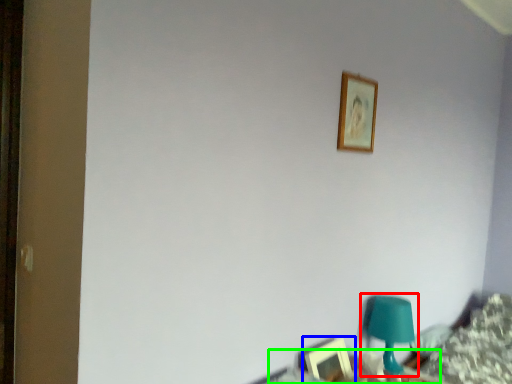
Question: Estimate the real-world distances between objects in this image. Which object is farther from table lamp (highlighted by a red box), picture frame (highlighted by a blue box) or table (highlighted by a green box)?

Choices:
 (A) picture frame
 (B) table

Answer: (A)